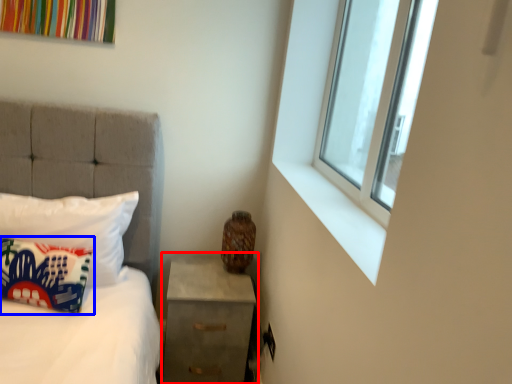
Question: Which of the following is the closest to the observer, nightstand (highlighted by a red box) or pillow (highlighted by a blue box)?

Choices:
 (A) nightstand
 (B) pillow

Answer: (B)